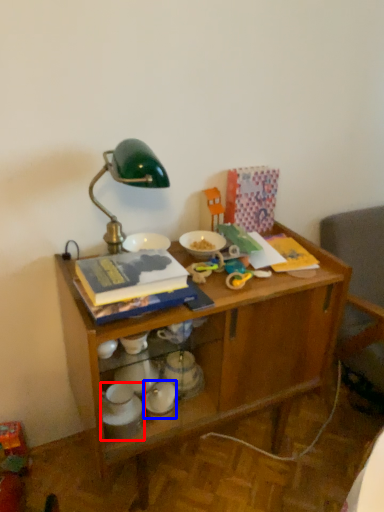
Question: Which object is further to the camera taking this photo, tableware (highlighted by a red box) or tableware (highlighted by a blue box)?

Choices:
 (A) tableware
 (B) tableware

Answer: (B)